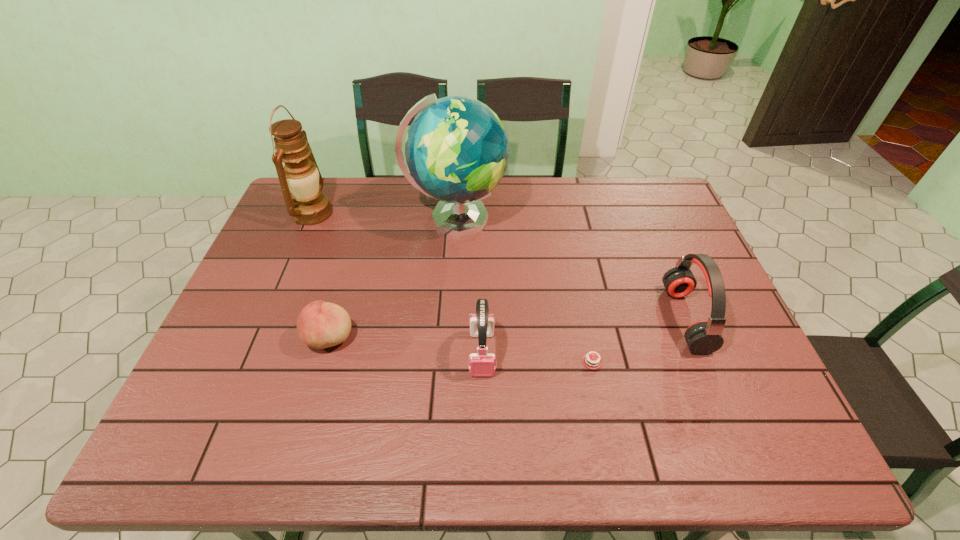
This screenshot has width=960, height=540. Identify the location of globe. (457, 150).

Where is `oil lamp`? oil lamp is located at coordinates (308, 206).

This screenshot has width=960, height=540. I want to click on the right earphone, so click(703, 337).

Find the location of a particular element. This screenshot has height=540, width=960. the left earphone is located at coordinates (481, 364).

Where is `the second object from left to right`? Image resolution: width=960 pixels, height=540 pixels. the second object from left to right is located at coordinates (320, 324).

Image resolution: width=960 pixels, height=540 pixels. In order to click on the fifth tallest object in this screenshot , I will do `click(320, 324)`.

At what (x,y) coordinates should I click in order to perform the action: click on the shortest object. Please return your answer as a coordinate pair (x, y). The width and height of the screenshot is (960, 540). Looking at the image, I should click on (588, 361).

Locate an element on the screen. Image resolution: width=960 pixels, height=540 pixels. chocolate cake is located at coordinates (588, 361).

In order to click on blank space located on the front surface of the globe in this screenshot , I will do pos(609,219).

Where is `free space located on the right of the oil lamp`? The height and width of the screenshot is (540, 960). free space located on the right of the oil lamp is located at coordinates (357, 213).